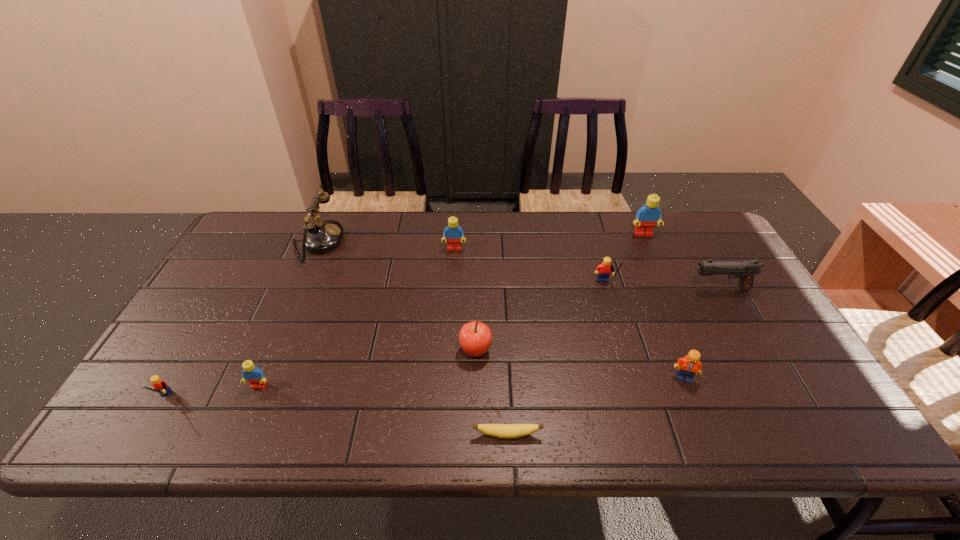
The image size is (960, 540). Identify the location of the fifth closest Lego to the black telephone. (647, 216).

Point out which blue Lego is positioned as the nearest to the farthest Lego. Please provide its 2D coordinates. Your answer should be formatted as a tuple, i.e. [(x, y)], where the tuple contains the x and y coordinates of a point satisfying the conditions above.

[(453, 233)]

Identify which blue Lego is the third nearest to the seventh object from left to right. Please provide its 2D coordinates. Your answer should be formatted as a tuple, i.e. [(x, y)], where the tuple contains the x and y coordinates of a point satisfying the conditions above.

[(251, 373)]

The height and width of the screenshot is (540, 960). I want to click on free region that satisfies the following two spatial constraints: 1. on the dial of the black telephone; 2. on the front-facing side of the leftmost Lego, so click(249, 400).

Locate an element on the screen. vacant area that satisfies the following two spatial constraints: 1. on the face of the smallest blue Lego; 2. on the right side of the shortest object is located at coordinates (x=239, y=435).

Where is `free point that satisfies the following two spatial constraints: 1. on the front side of the apple; 2. on the left side of the nearest object`? The image size is (960, 540). free point that satisfies the following two spatial constraints: 1. on the front side of the apple; 2. on the left side of the nearest object is located at coordinates coord(475,435).

Where is `free region that satisfies the following two spatial constraints: 1. in the direction the rightmost object is aimed; 2. on the front-facing side of the orange Lego`? This screenshot has width=960, height=540. free region that satisfies the following two spatial constraints: 1. in the direction the rightmost object is aimed; 2. on the front-facing side of the orange Lego is located at coordinates 771,378.